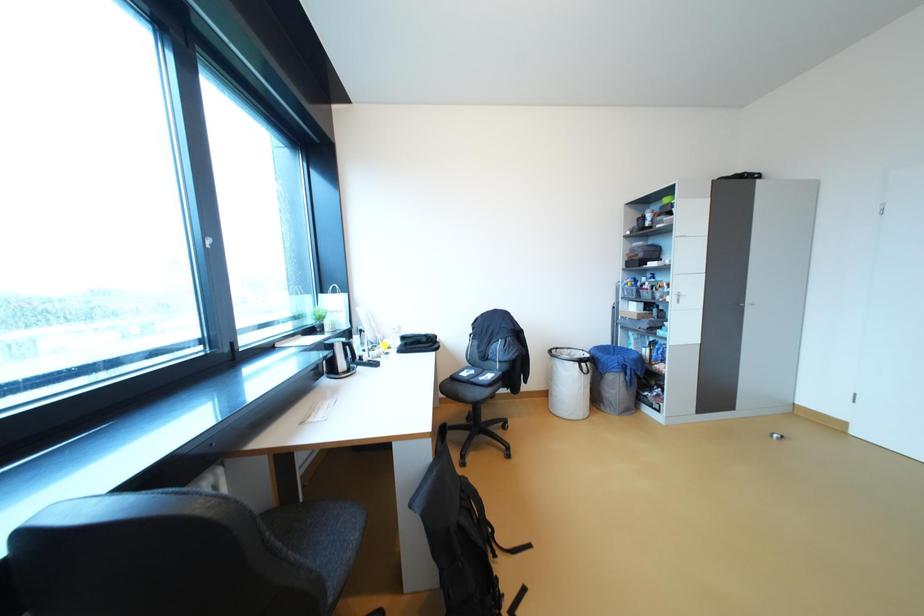
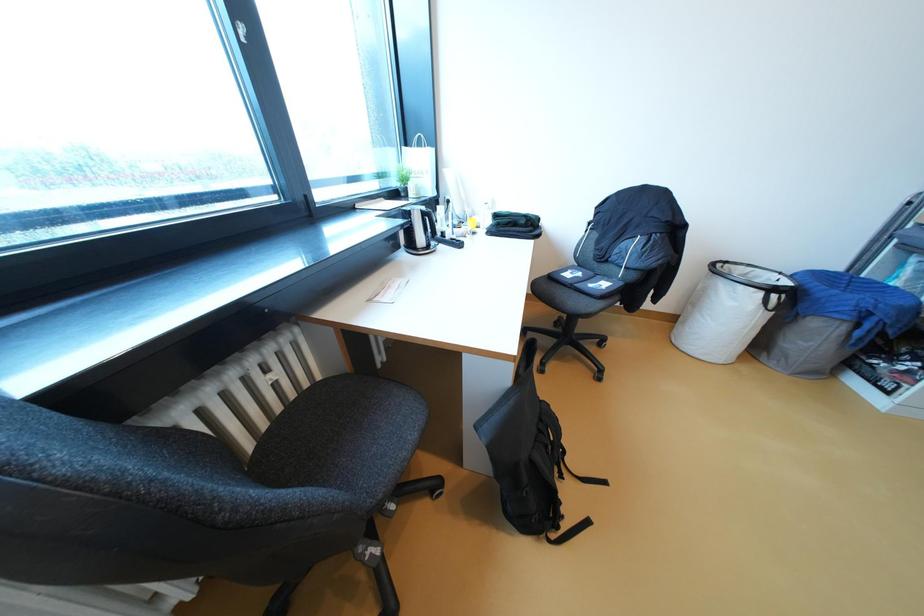
Based on the continuous images, in which direction is the camera rotating?

The rotation direction of the camera is left-down.